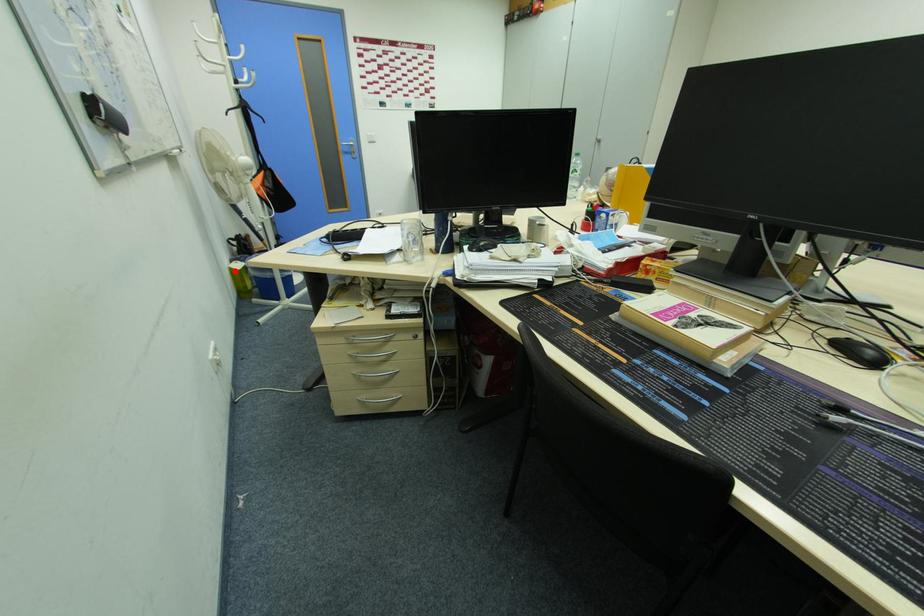
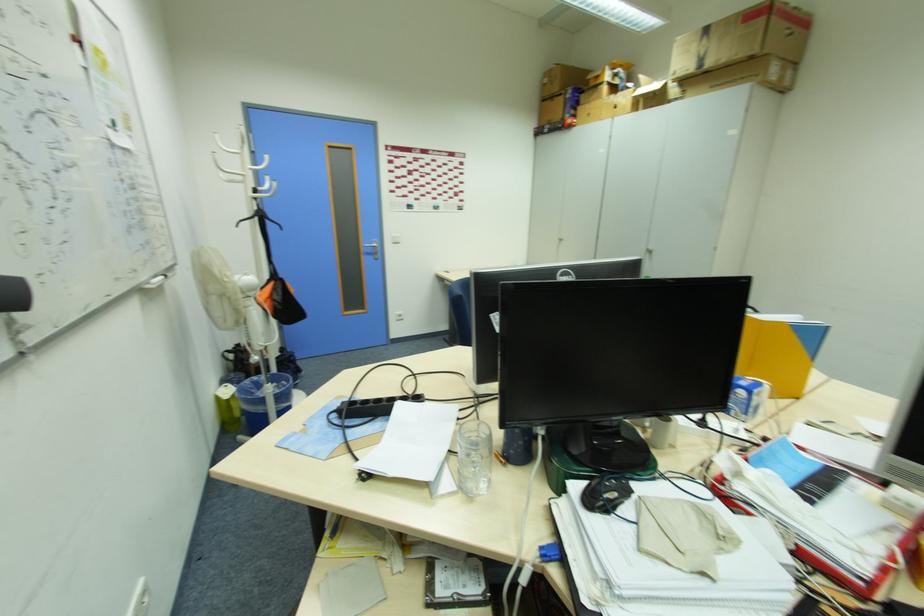
In the second image, find the point that corresponds to the highlighted location in the first image.

(220, 400)